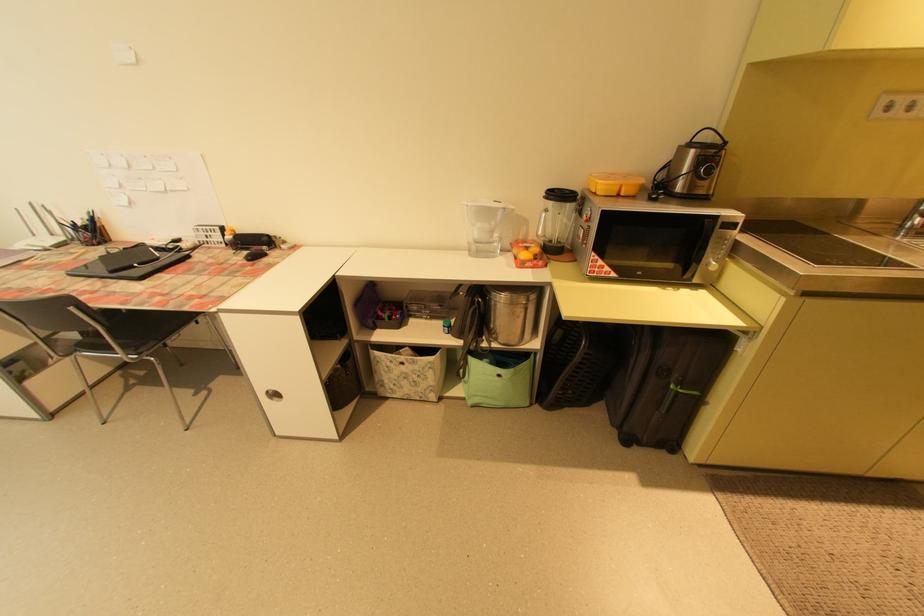
Describe the element at coordinates (682, 389) in the screenshot. I see `a black suitcase handle` at that location.